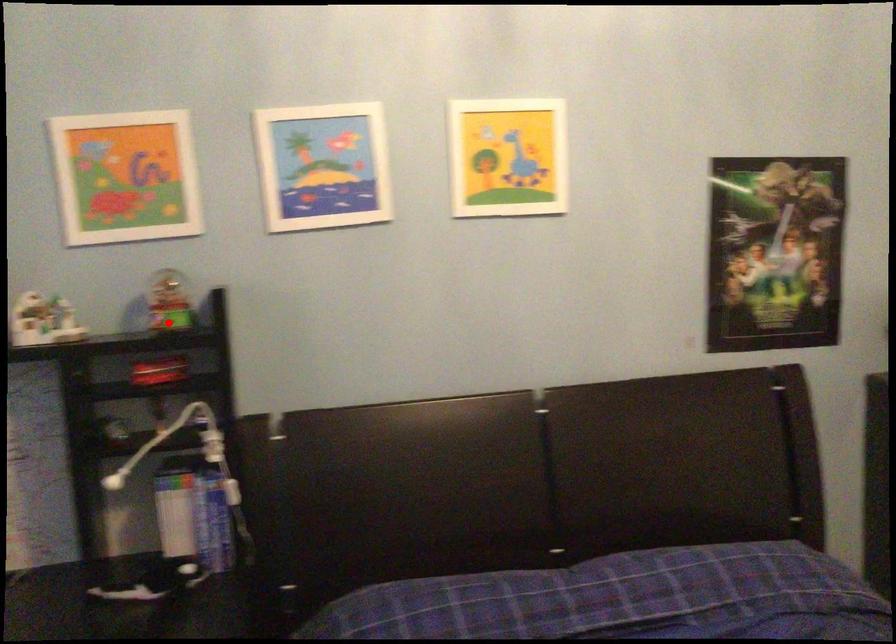
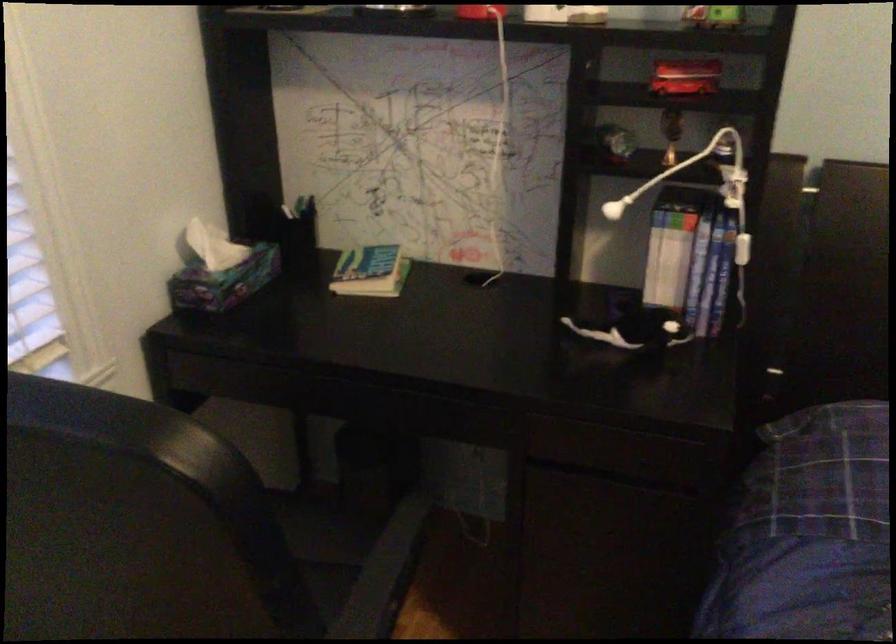
Where in the second image is the point corresponding to the highlighted location from the first image?

(713, 17)